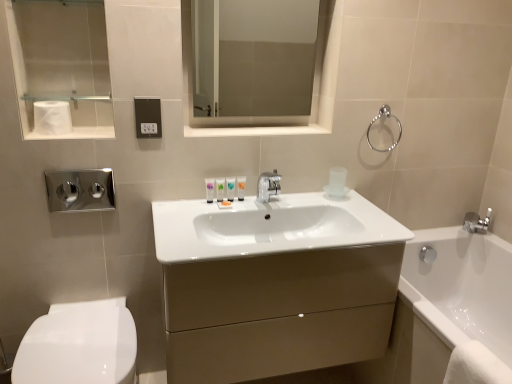
Question: Is brushed metal towel bar at upper left shorter than translucent plastic tube at center, the third toiletry in the left-to-right sequence?

Choices:
 (A) no
 (B) yes

Answer: (B)

Question: Is brushed metal towel bar at upper left to the right of translucent plastic tube at center, the third toiletry in the left-to-right sequence, from the viewer's perspective?

Choices:
 (A) yes
 (B) no

Answer: (B)

Question: From a real-world perspective, is brushed metal towel bar at upper left on translucent plastic tube at center, which is counted as the second toiletry, starting from the right?

Choices:
 (A) no
 (B) yes

Answer: (B)

Question: Is brushed metal towel bar at upper left oriented away from translucent plastic tube at center, the third toiletry in the left-to-right sequence?

Choices:
 (A) no
 (B) yes

Answer: (A)

Question: Considering the relative sizes of brushed metal towel bar at upper left and translucent plastic tube at center, which is counted as the second toiletry, starting from the right, in the image provided, is brushed metal towel bar at upper left thinner than translucent plastic tube at center, which is counted as the second toiletry, starting from the right,?

Choices:
 (A) yes
 (B) no

Answer: (B)

Question: Is transparent glass medicine cabinet at upper center wider or thinner than silver metallic towel ring at upper right?

Choices:
 (A) wide
 (B) thin

Answer: (B)

Question: Visually, is transparent glass medicine cabinet at upper center positioned to the left or to the right of silver metallic towel ring at upper right?

Choices:
 (A) left
 (B) right

Answer: (A)

Question: Would you say transparent glass medicine cabinet at upper center is inside or outside silver metallic towel ring at upper right?

Choices:
 (A) outside
 (B) inside

Answer: (A)

Question: From a real-world perspective, relative to silver metallic towel ring at upper right, is transparent glass medicine cabinet at upper center vertically above or below?

Choices:
 (A) above
 (B) below

Answer: (A)

Question: Is black plastic outlet at center inside or outside of translucent plastic tube at center, the third toiletry in the left-to-right sequence?

Choices:
 (A) inside
 (B) outside

Answer: (B)

Question: In terms of width, does black plastic outlet at center look wider or thinner when compared to translucent plastic tube at center, which is counted as the second toiletry, starting from the right?

Choices:
 (A) wide
 (B) thin

Answer: (B)

Question: Is black plastic outlet at center in front of or behind translucent plastic tube at center, which is counted as the second toiletry, starting from the right, in the image?

Choices:
 (A) behind
 (B) front

Answer: (B)

Question: In the image, is black plastic outlet at center on the left side or the right side of translucent plastic tube at center, which is counted as the second toiletry, starting from the right?

Choices:
 (A) right
 (B) left

Answer: (B)

Question: Visually, is white glossy tube at center, positioned as the second toiletry in left-to-right order, positioned to the left or to the right of white matte toilet paper at upper left?

Choices:
 (A) left
 (B) right

Answer: (B)

Question: Is white glossy tube at center, positioned as the second toiletry in left-to-right order, taller or shorter than white matte toilet paper at upper left?

Choices:
 (A) tall
 (B) short

Answer: (B)